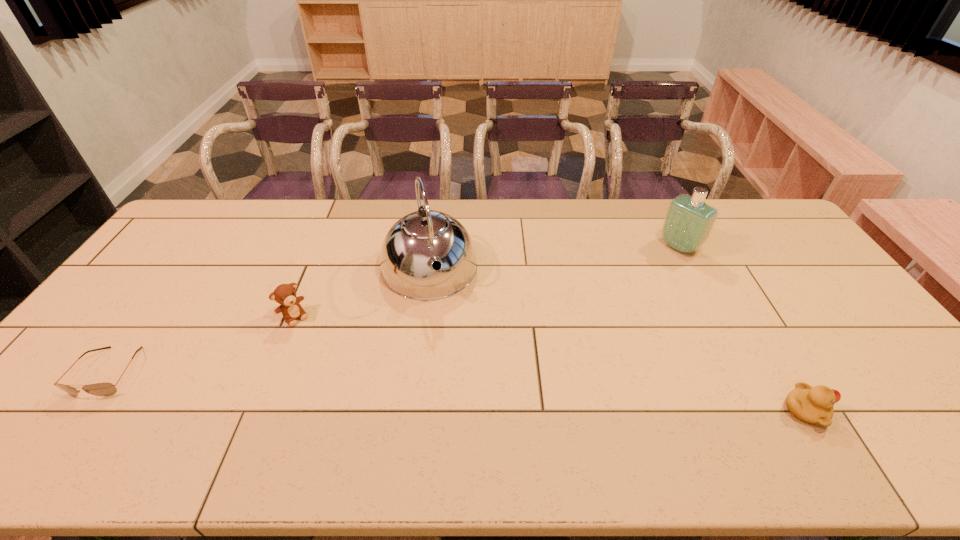
You are a GUI agent. You are given a task and a screenshot of the screen. Output one action in this format:
    pyautogui.click(x=<x>, y=<y>)
    Task: Click on the sunglasses at the near edge
    The width and height of the screenshot is (960, 540).
    Given the screenshot: What is the action you would take?
    pyautogui.click(x=99, y=389)

This screenshot has height=540, width=960. I want to click on duckling positioned at the near edge, so click(x=814, y=405).

At what (x,y) coordinates should I click in order to perform the action: click on object at the left edge. Please return your answer as a coordinate pair (x, y). This screenshot has width=960, height=540. Looking at the image, I should click on coord(99,389).

The width and height of the screenshot is (960, 540). Find the location of `object that is at the near left corner`. object that is at the near left corner is located at coordinates (99, 389).

Image resolution: width=960 pixels, height=540 pixels. Find the location of `vacant space at the far edge of the desktop`. vacant space at the far edge of the desktop is located at coordinates tap(528, 217).

Find the location of `vacant space at the near edge of the desktop`. vacant space at the near edge of the desktop is located at coordinates (266, 410).

Identify the location of free location at the left edge of the desktop. (152, 295).

The image size is (960, 540). In the image, there is a desktop. Identify the location of vacant space at the right edge. (806, 262).

At what (x,y) coordinates should I click in order to perform the action: click on vacant space at the far left corner of the desktop. Please return your answer as a coordinate pair (x, y). The height and width of the screenshot is (540, 960). Looking at the image, I should click on (200, 223).

Identify the location of unoccupied area between the kettle and the duckling. The height and width of the screenshot is (540, 960). (x=617, y=340).